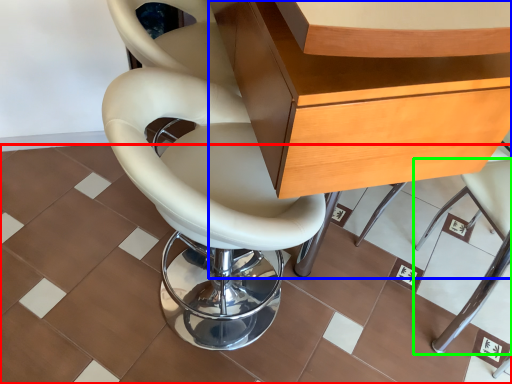
Question: Which is farther away from ceramic tile (highlighted by a red box)? desk (highlighted by a blue box) or chair (highlighted by a green box)?

Choices:
 (A) desk
 (B) chair

Answer: (A)